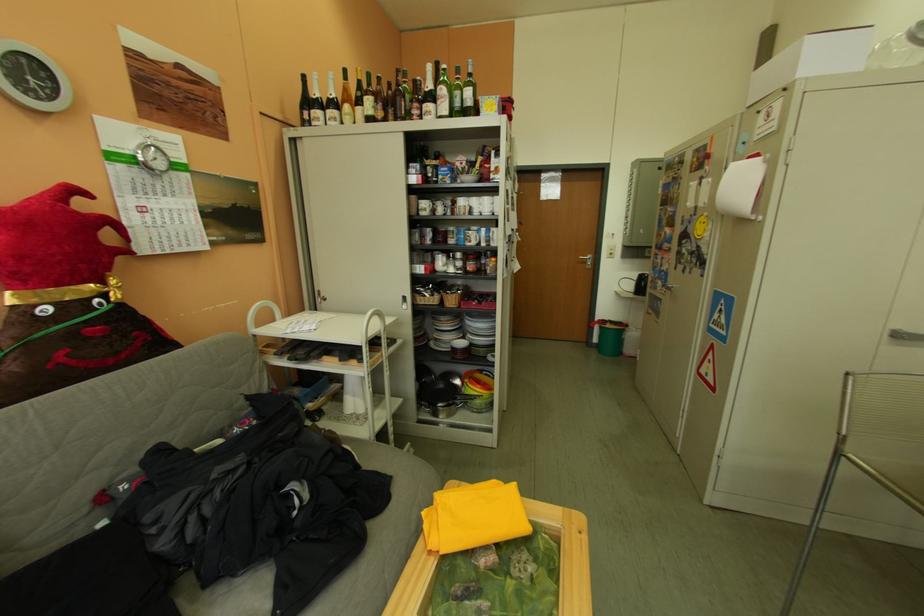
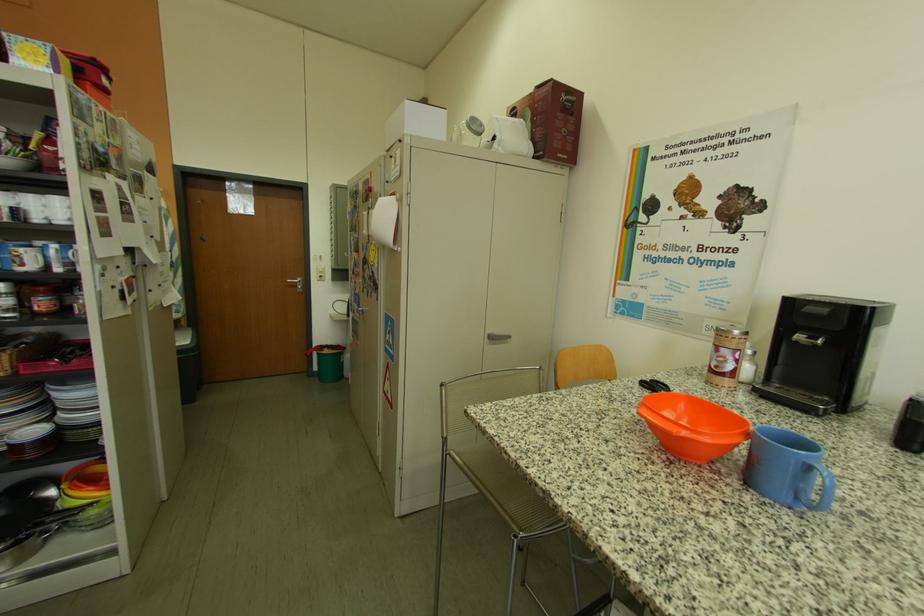
The point at (856, 456) is marked in the first image. Where is the corresponding point in the second image?

(460, 456)